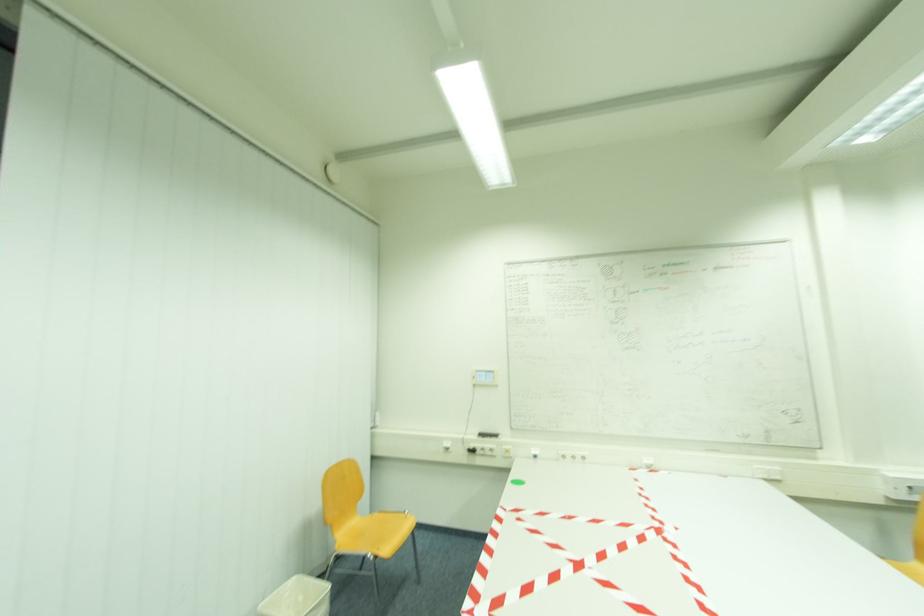
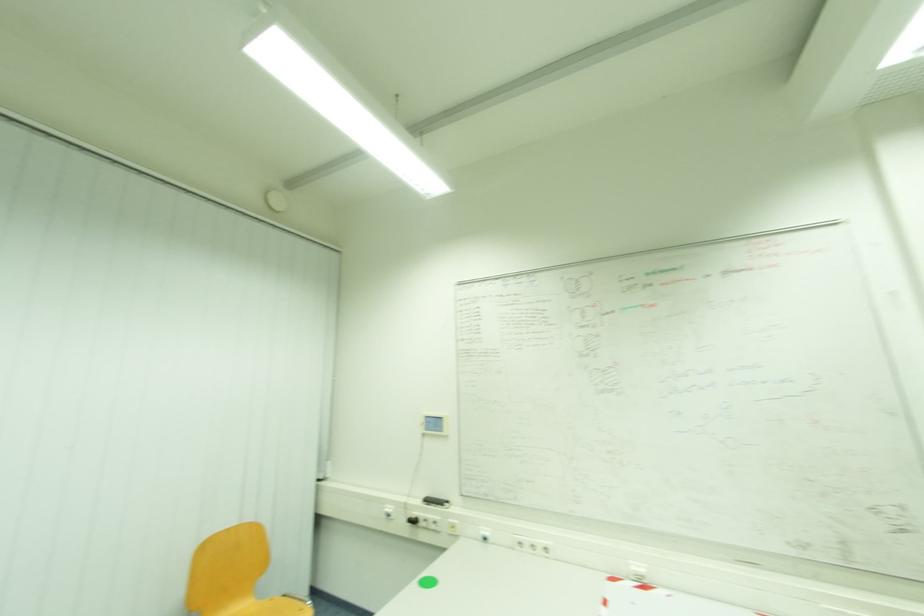
What movement of the cameraman would produce the second image?

The cameraman walked toward right, forward.